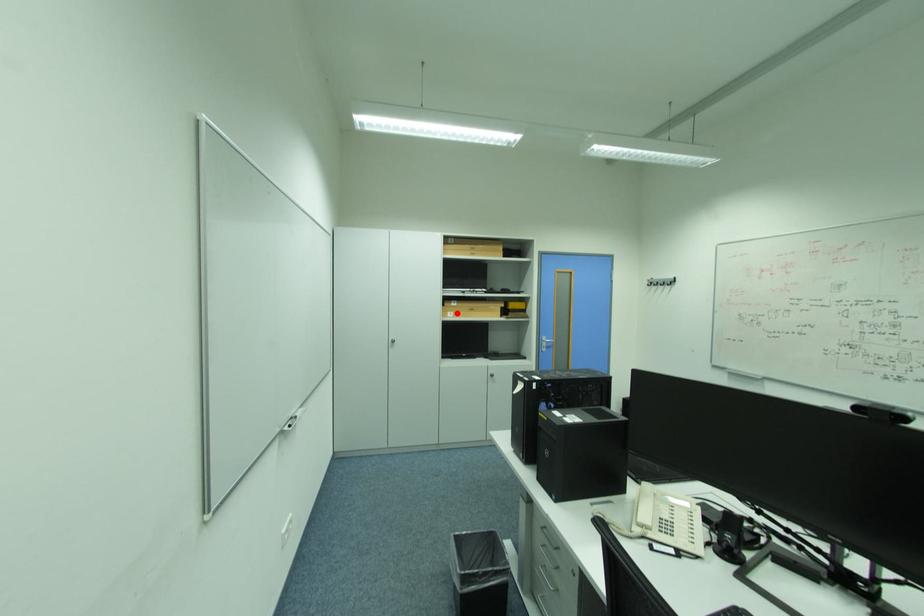
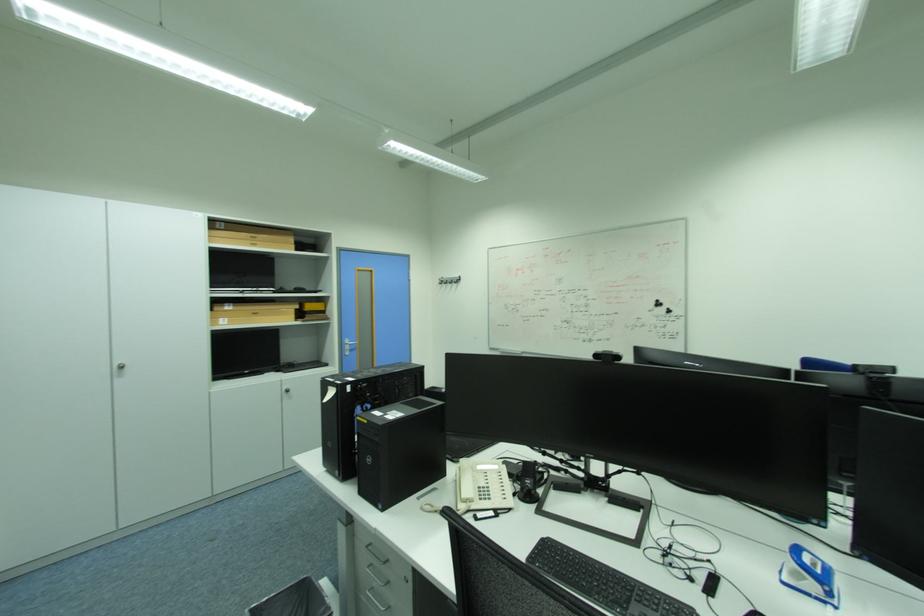
The point at the highlighted location is marked in the first image. Where is the corresponding point in the second image?

(228, 320)